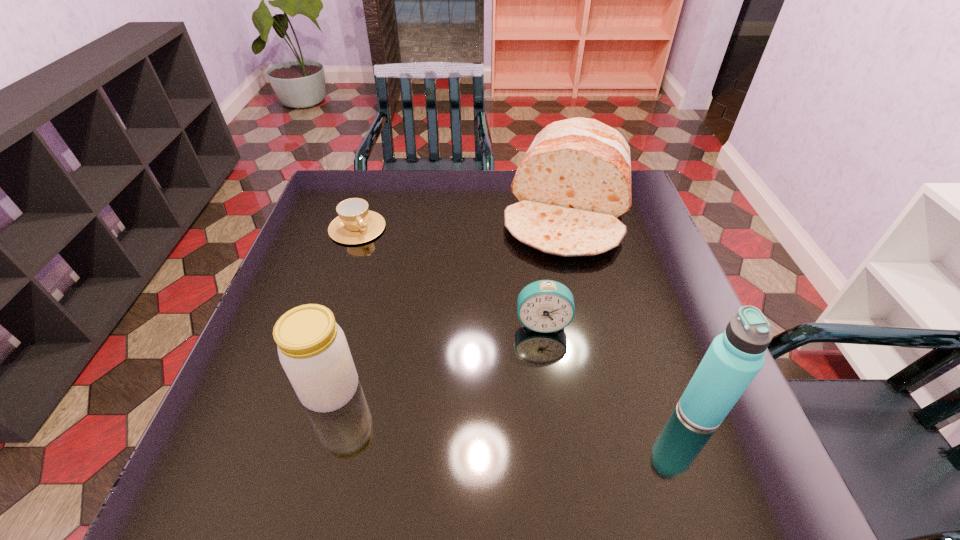
Find the location of a particular element. jar is located at coordinates (313, 351).

Locate an element on the screen. The height and width of the screenshot is (540, 960). thermos bottle is located at coordinates (734, 358).

You are a GUI agent. You are given a task and a screenshot of the screen. Output one action in this format:
    pyautogui.click(x=<x>, y=<y>)
    Task: Click on the third farthest object
    This screenshot has height=540, width=960.
    Given the screenshot: What is the action you would take?
    pyautogui.click(x=545, y=306)

Where is `alarm clock`? alarm clock is located at coordinates (545, 306).

Identify the location of bread. (574, 182).

This screenshot has height=540, width=960. I want to click on the shortest object, so click(355, 224).

Identify the location of vacant space located on the left of the jar. The width and height of the screenshot is (960, 540). (241, 390).

Identify the location of vacant space located on the back of the thermos bottle. (684, 372).

The height and width of the screenshot is (540, 960). I want to click on free space located 0.220m on the front-facing side of the third nearest object, so click(545, 430).

Identify the location of free region located 0.090m on the front-facing side of the third nearest object. (543, 370).